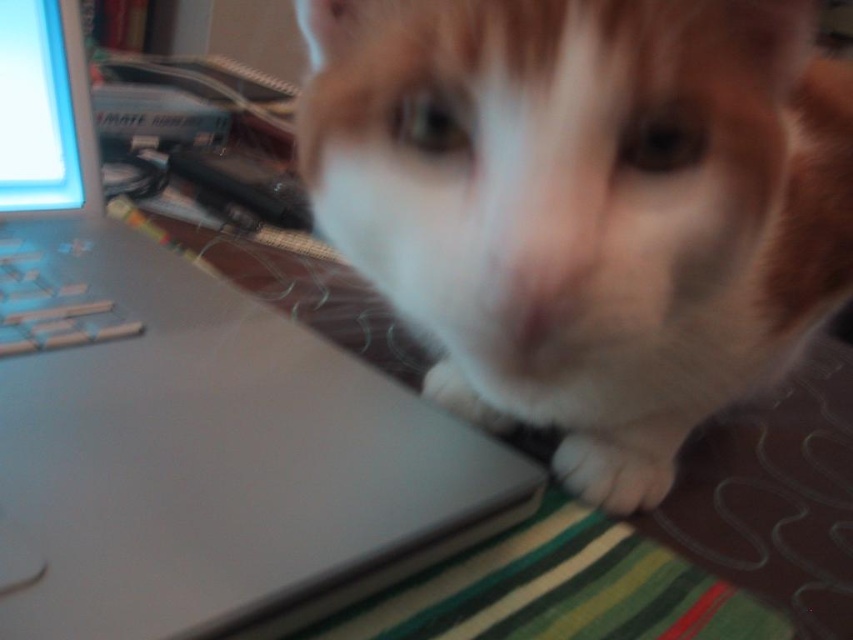
Question: Is matte silver laptop at upper left to the left of white fur paw at lower center from the viewer's perspective?

Choices:
 (A) no
 (B) yes

Answer: (B)

Question: Which point is farther to the camera?

Choices:
 (A) (654, 433)
 (B) (728, 49)

Answer: (A)

Question: Which object is closer to the camera taking this photo?

Choices:
 (A) white fur paw at lower center
 (B) white fur cat at center
 (C) matte silver laptop at upper left

Answer: (B)

Question: Which object is the closest to the satin silver keys at lower left?

Choices:
 (A) white fur paw at lower center
 (B) white fur cat at center

Answer: (B)

Question: Is white fur cat at center below matte silver laptop at upper left?

Choices:
 (A) yes
 (B) no

Answer: (B)

Question: Is matte silver laptop at upper left bigger than white fur paw at lower center?

Choices:
 (A) yes
 (B) no

Answer: (A)